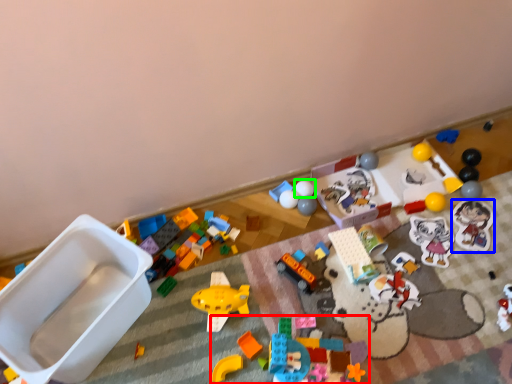
Question: Which object is positioned farthest from toy (highlighted by a red box)? Select from toy (highlighted by a blue box) and toy (highlighted by a green box).

Choices:
 (A) toy
 (B) toy

Answer: (A)